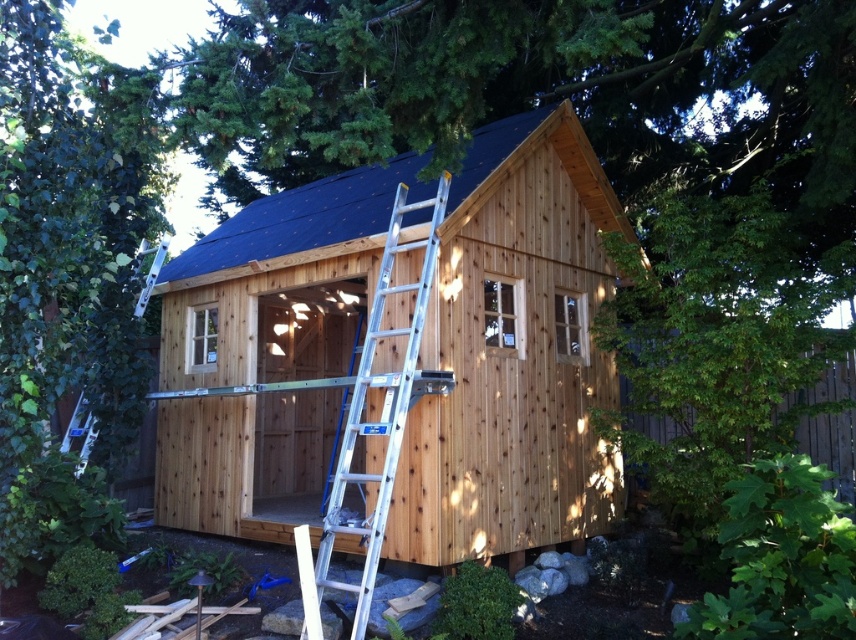
Question: Based on their relative distances, which object is farther from the dark blue shingles at upper center?

Choices:
 (A) silver metallic ladder at center
 (B) natural wood cabin at center

Answer: (A)

Question: Can you confirm if natural wood cabin at center is positioned above dark blue shingles at upper center?

Choices:
 (A) yes
 (B) no

Answer: (B)

Question: Which point is closer to the camera?

Choices:
 (A) silver metallic ladder at center
 (B) dark blue shingles at upper center
 (C) natural wood cabin at center
 (D) white metallic ladder at upper left

Answer: (A)

Question: Among these points, which one is farthest from the camera?

Choices:
 (A) (449, 200)
 (B) (388, 228)
 (C) (84, 435)
 (D) (241, 509)

Answer: (C)

Question: Considering the relative positions of silver metallic ladder at center and white metallic ladder at upper left in the image provided, where is silver metallic ladder at center located with respect to white metallic ladder at upper left?

Choices:
 (A) right
 (B) left

Answer: (A)

Question: Does dark blue shingles at upper center appear under silver metallic ladder at center?

Choices:
 (A) no
 (B) yes

Answer: (A)